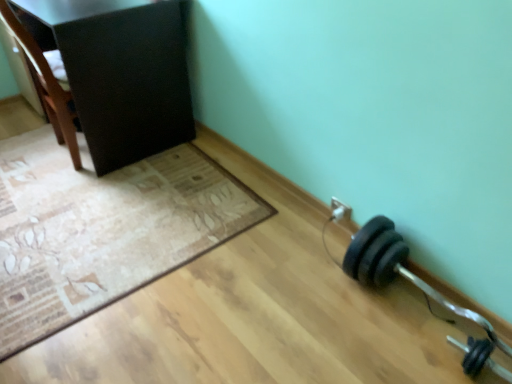
Question: Should I look upward or downward to see brown wood chair at upper left?

Choices:
 (A) up
 (B) down

Answer: (A)

Question: Can you confirm if brown wood chair at upper left is positioned to the right of black rubber dumbbell at lower right, which is the 1th dumbbell from top to bottom?

Choices:
 (A) no
 (B) yes

Answer: (A)

Question: From the image's perspective, is brown wood chair at upper left on top of black rubber dumbbell at lower right, which is the 1th dumbbell from top to bottom?

Choices:
 (A) no
 (B) yes

Answer: (B)

Question: Can you confirm if brown wood chair at upper left is positioned to the left of black rubber dumbbell at lower right, the second dumbbell when ordered from bottom to top?

Choices:
 (A) no
 (B) yes

Answer: (B)

Question: Is brown wood chair at upper left far from black rubber dumbbell at lower right, the second dumbbell when ordered from bottom to top?

Choices:
 (A) no
 (B) yes

Answer: (B)

Question: From the image's perspective, is brown wood chair at upper left under black rubber dumbbell at lower right, which is the 1th dumbbell from top to bottom?

Choices:
 (A) no
 (B) yes

Answer: (A)

Question: From a real-world perspective, is brown wood chair at upper left on black rubber dumbbell at lower right, the second dumbbell when ordered from bottom to top?

Choices:
 (A) no
 (B) yes

Answer: (B)

Question: Is black rubber dumbbell at lower right, which is the 1th dumbbell from top to bottom, shorter than brown wood chair at upper left?

Choices:
 (A) yes
 (B) no

Answer: (A)

Question: Is the depth of black rubber dumbbell at lower right, the second dumbbell when ordered from bottom to top, less than that of brown wood chair at upper left?

Choices:
 (A) yes
 (B) no

Answer: (A)

Question: Considering the relative sizes of black rubber dumbbell at lower right, which is the 1th dumbbell from top to bottom, and brown wood chair at upper left in the image provided, is black rubber dumbbell at lower right, which is the 1th dumbbell from top to bottom, taller than brown wood chair at upper left?

Choices:
 (A) no
 (B) yes

Answer: (A)

Question: Is the position of black rubber dumbbell at lower right, which is the 1th dumbbell from top to bottom, more distant than that of brown wood chair at upper left?

Choices:
 (A) no
 (B) yes

Answer: (A)

Question: Is black rubber dumbbell at lower right, the second dumbbell when ordered from bottom to top, turned away from brown wood chair at upper left?

Choices:
 (A) yes
 (B) no

Answer: (B)

Question: From the image's perspective, is black rubber dumbbell at lower right, the second dumbbell when ordered from bottom to top, on brown wood chair at upper left?

Choices:
 (A) no
 (B) yes

Answer: (A)

Question: Is matte black cabinet at upper left positioned before beige textured mat at lower left?

Choices:
 (A) yes
 (B) no

Answer: (B)